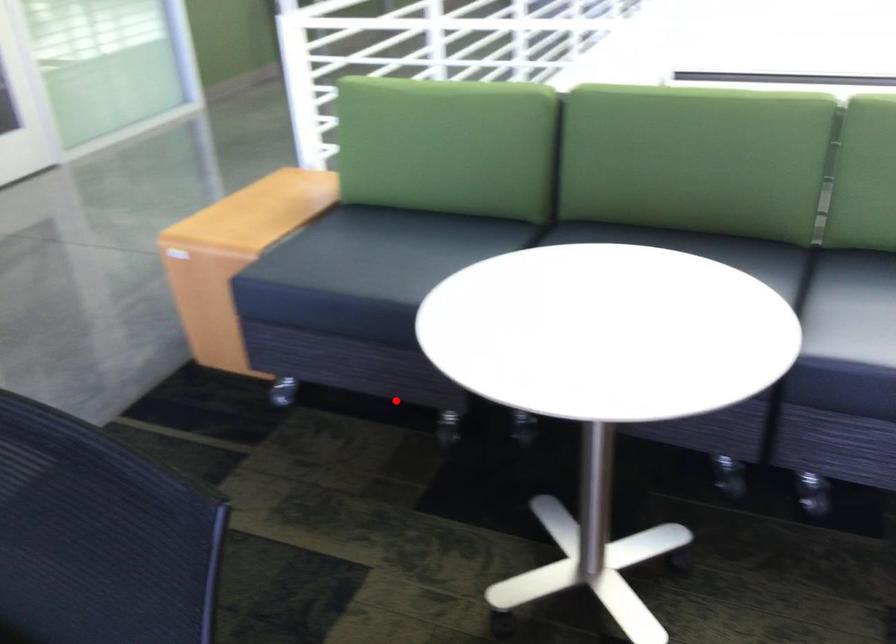
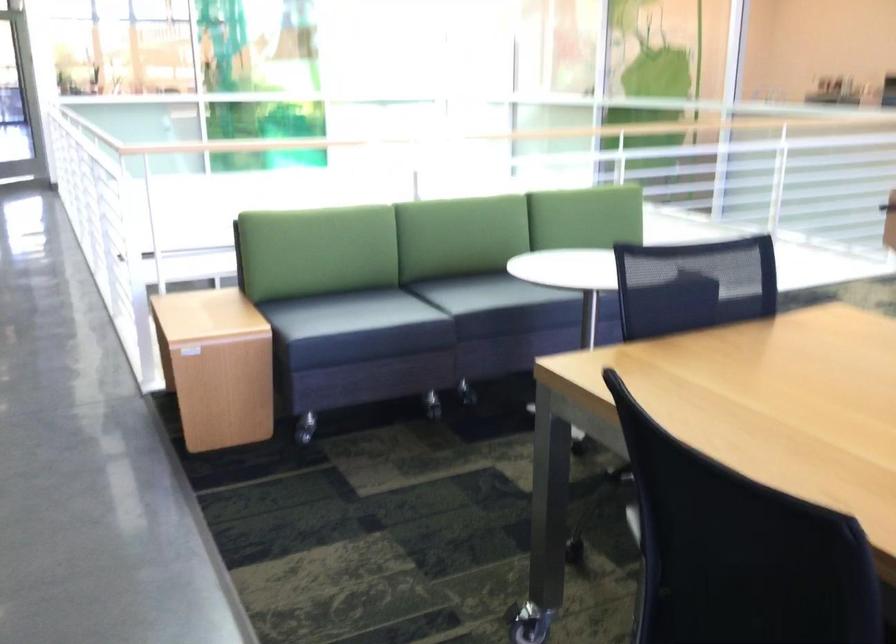
In the second image, find the point that corresponds to the highlighted location in the first image.

(306, 427)